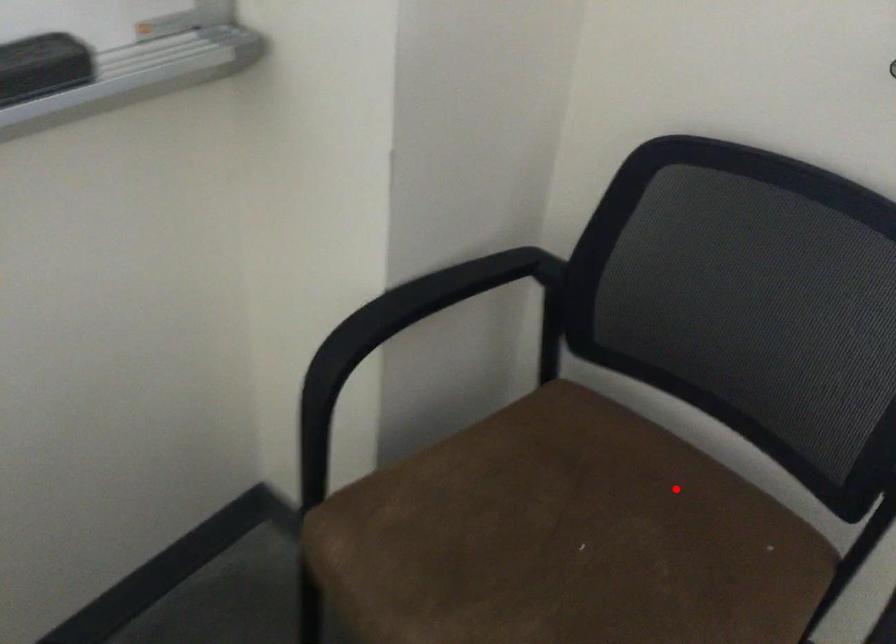
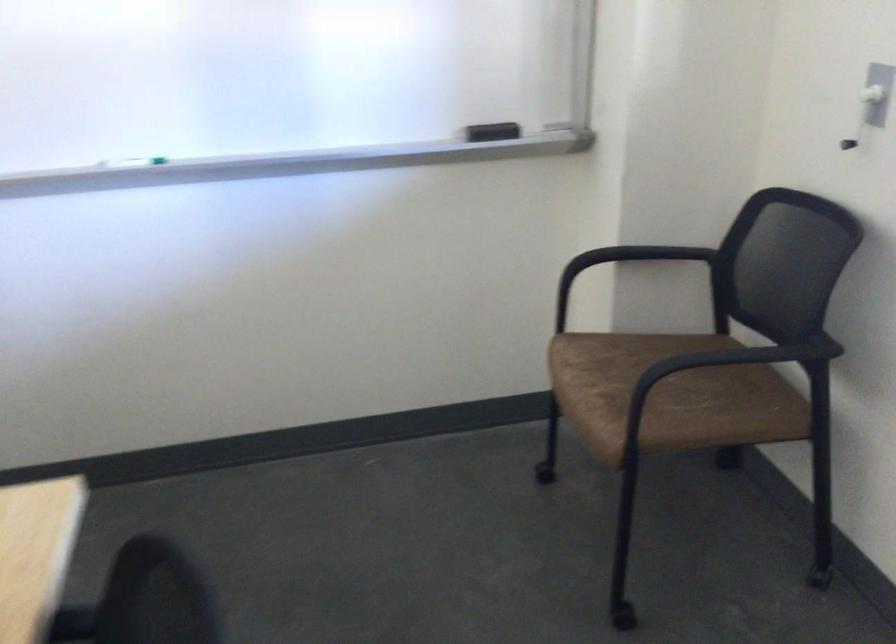
Question: I am providing you with two images of the same scene from different viewpoints. A red point is shown in image1. For the corresponding object point in image2, is it positioned nearer or farther from the camera?

Choices:
 (A) Nearer
 (B) Farther

Answer: (B)